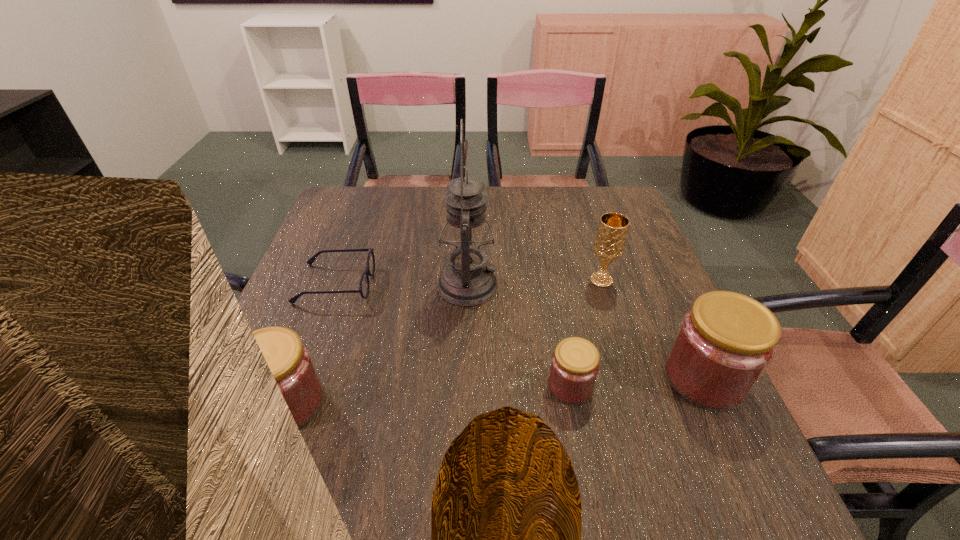
Please point a space for a new jam to maintain equal intervals. Please provide its 2D coordinates. Your answer should be formatted as a tuple, i.e. [(x, y)], where the tuple contains the x and y coordinates of a point satisfying the conditions above.

[(432, 394)]